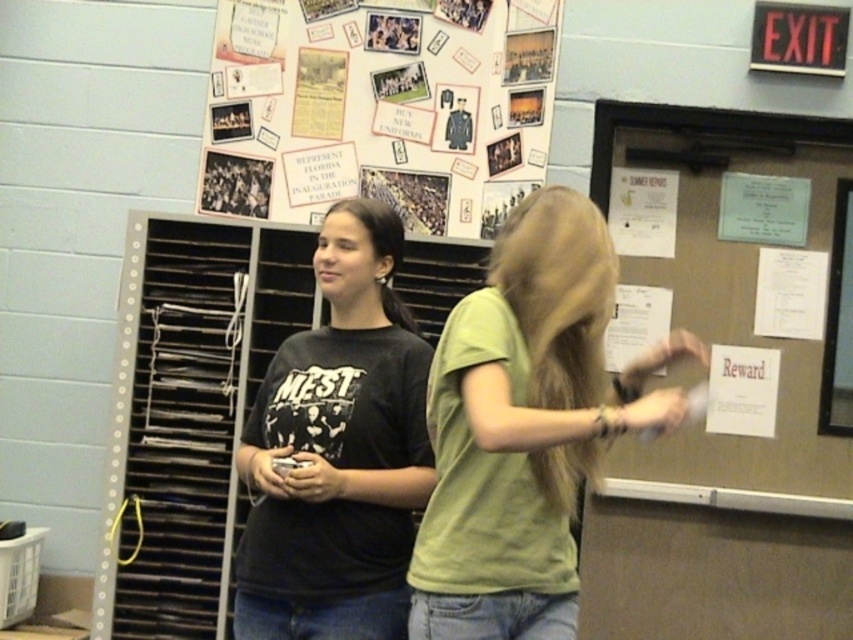
Which is in front, point (453, 163) or point (282, 385)?

Point (282, 385) is in front.

Can you confirm if multicolored collage at upper center is positioned above black matte t-shirt at center?

Indeed, multicolored collage at upper center is positioned over black matte t-shirt at center.

Where is `multicolored collage at upper center`? multicolored collage at upper center is located at coordinates (380, 108).

In the scene shown: Is multicolored collage at upper center behind matte brown paperboard at right?

Yes.

Is multicolored collage at upper center taller than matte brown paperboard at right?

In fact, multicolored collage at upper center may be shorter than matte brown paperboard at right.

Does point (392, 70) come farther from viewer compared to point (788, 406)?

No, it is in front of (788, 406).

Locate an element on the screen. The width and height of the screenshot is (853, 640). multicolored collage at upper center is located at coordinates (380, 108).

This screenshot has width=853, height=640. What do you see at coordinates (525, 426) in the screenshot? I see `green matte shirt at center` at bounding box center [525, 426].

Who is taller, green matte shirt at center or white paper reward at upper right?

With more height is green matte shirt at center.

Is point (502, 428) farther from camera compared to point (756, 416)?

That is False.

Find the location of a particular element. This screenshot has width=853, height=640. green matte shirt at center is located at coordinates (525, 426).